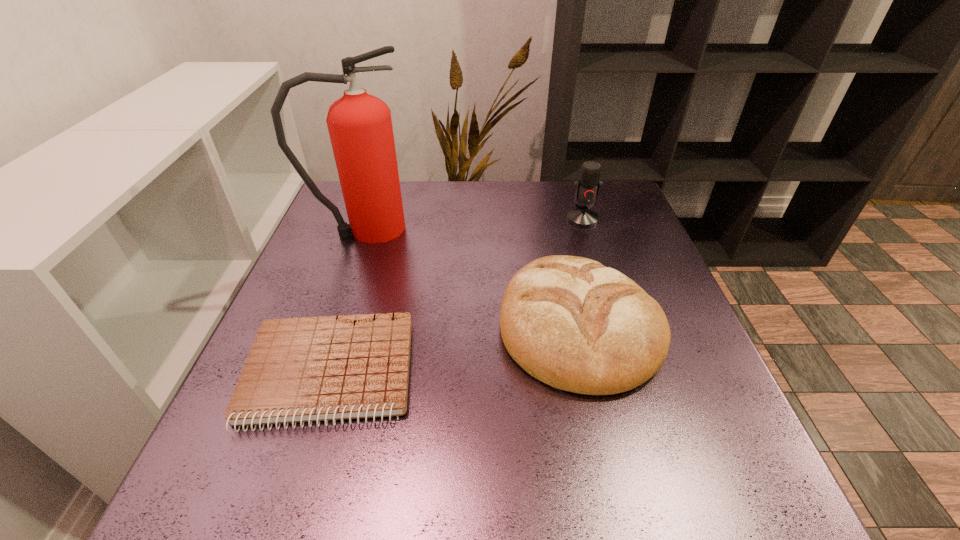
The height and width of the screenshot is (540, 960). I want to click on fire extinguisher present at the left edge, so click(x=360, y=127).

I want to click on notebook present at the left edge, so click(306, 369).

Identify the location of microphone that is positioned at the right edge. (587, 187).

Find the location of a particular element. The image size is (960, 540). bread at the right edge is located at coordinates (572, 323).

You are a GUI agent. You are given a task and a screenshot of the screen. Output one action in this format:
    pyautogui.click(x=<x>, y=<y>)
    Task: Click on the object present at the far left corner
    
    Given the screenshot: What is the action you would take?
    pyautogui.click(x=360, y=127)

Identify the location of object that is at the far right corner. The image size is (960, 540). (587, 187).

The width and height of the screenshot is (960, 540). Identify the location of free location at the far edge. (424, 216).

You are a GUI agent. You are given a task and a screenshot of the screen. Output one action in this format:
    pyautogui.click(x=<x>, y=<y>)
    Task: Click on the vacant region at the near edge of the desktop
    The height and width of the screenshot is (540, 960).
    Given the screenshot: What is the action you would take?
    pyautogui.click(x=574, y=472)

Where is `free space at the left edge`? Image resolution: width=960 pixels, height=540 pixels. free space at the left edge is located at coordinates (333, 233).

Locate an element on the screen. vacant space at the right edge of the desktop is located at coordinates (664, 310).